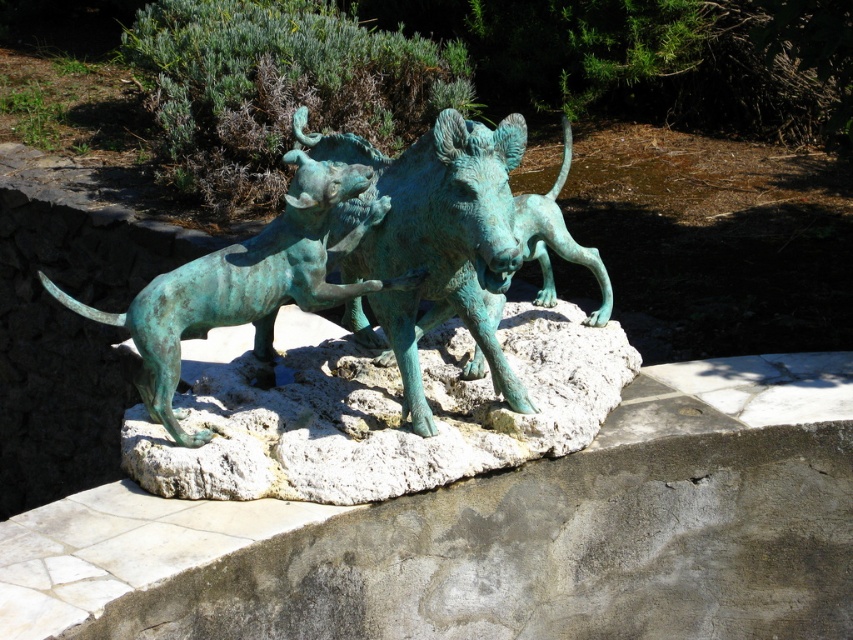
You are standing in front of the bronze sculpture and want to place a small flowerpot exactly where the green patina rock at center is located. What are the coordinates of the point where you should place the flowerpot?

The coordinates for the green patina rock at center are at point (379, 412), so you should place the flowerpot at those coordinates.

From the picture: You are standing in front of the bronze sculpture and want to touch the point at coordinates (500, 456). Considering the sculpture is 2.5 meters tall, can you reach the point without a ladder?

The point at (500, 456) is 3.75 meters away from the viewer. Since the sculpture is 2.5 meters tall, the point is likely above your reach unless you have a ladder to stand on.

You are an art conservator assessing the stability of the sculpture. The green patina rock at center and the green patina bronze boar at center are both part of the sculpture. Which object has a greater height?

The green patina bronze boar at center is taller than the green patina rock at center.